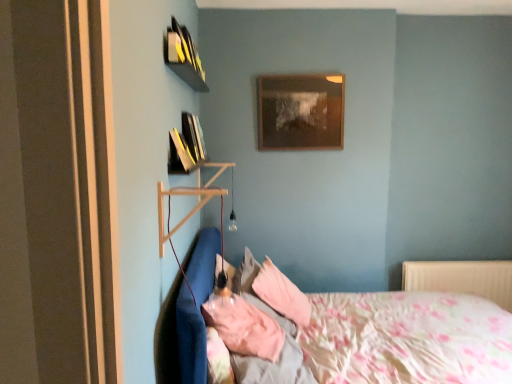
The width and height of the screenshot is (512, 384). What do you see at coordinates (186, 146) in the screenshot?
I see `hardcover books at upper left, which ranks as the 2th book in top-to-bottom order` at bounding box center [186, 146].

The width and height of the screenshot is (512, 384). Describe the element at coordinates (407, 338) in the screenshot. I see `fluffy cotton bed at lower left` at that location.

Measure the distance between yellow matte book at upper left, the second book from the bottom, and camera.

A distance of 6.39 feet exists between yellow matte book at upper left, the second book from the bottom, and camera.

The width and height of the screenshot is (512, 384). I want to click on white plastic radiator at lower right, so click(x=462, y=278).

From their relative heights in the image, would you say pink fabric pillow at center, positioned as the first pillow in front-to-back order, is taller or shorter than wooden picture frame at upper center?

In the image, pink fabric pillow at center, positioned as the first pillow in front-to-back order, appears to be shorter than wooden picture frame at upper center.

From the image's perspective, is pink fabric pillow at center, positioned as the first pillow in front-to-back order, above wooden picture frame at upper center?

No, from the image's perspective, pink fabric pillow at center, positioned as the first pillow in front-to-back order, is not above wooden picture frame at upper center.

Locate an element on the screen. The image size is (512, 384). picture frame located above the pink fabric pillow at center, positioned as the first pillow in front-to-back order (from a real-world perspective) is located at coordinates (301, 112).

Considering the positions of objects pink fabric pillow at center, positioned as the first pillow in front-to-back order, and wooden picture frame at upper center in the image provided, who is in front, pink fabric pillow at center, positioned as the first pillow in front-to-back order, or wooden picture frame at upper center?

pink fabric pillow at center, positioned as the first pillow in front-to-back order, is in front.

Consider the image. From a real-world perspective, is hardcover books at upper left, which ranks as the 1th book in bottom-to-top order, positioned over yellow matte book at upper left, the second book from the bottom, based on gravity?

Actually, hardcover books at upper left, which ranks as the 1th book in bottom-to-top order, is physically below yellow matte book at upper left, the second book from the bottom, in the real world.

Where is `book above the hardcover books at upper left, which ranks as the 1th book in bottom-to-top order (from the image's perspective)`? The width and height of the screenshot is (512, 384). book above the hardcover books at upper left, which ranks as the 1th book in bottom-to-top order (from the image's perspective) is located at coordinates [184, 56].

How distant is hardcover books at upper left, which ranks as the 1th book in bottom-to-top order, from yellow matte book at upper left, the second book from the bottom?

The distance of hardcover books at upper left, which ranks as the 1th book in bottom-to-top order, from yellow matte book at upper left, the second book from the bottom, is 13.65 inches.

Can you confirm if hardcover books at upper left, which ranks as the 2th book in top-to-bottom order, is shorter than yellow matte book at upper left, the second book from the bottom?

No, hardcover books at upper left, which ranks as the 2th book in top-to-bottom order, is not shorter than yellow matte book at upper left, the second book from the bottom.

From a real-world perspective, is white plastic radiator at lower right over fluffy cotton bed at lower left?

Incorrect, from a real-world perspective, white plastic radiator at lower right is lower than fluffy cotton bed at lower left.

Looking at this image, which object is further away from the camera, white plastic radiator at lower right or fluffy cotton bed at lower left?

Positioned behind is white plastic radiator at lower right.

Which is behind, point (473, 272) or point (210, 262)?

The point (473, 272) is farther.

Can you tell me how much white plastic radiator at lower right and fluffy cotton bed at lower left differ in facing direction?

The angle between the facing direction of white plastic radiator at lower right and the facing direction of fluffy cotton bed at lower left is 90.2 degrees.

Who is more distant, wooden picture frame at upper center or pink fabric pillow at center, the 2th pillow viewed from the back?

wooden picture frame at upper center is more distant.

Is wooden picture frame at upper center oriented away from pink fabric pillow at center, positioned as the first pillow in front-to-back order?

No, wooden picture frame at upper center is not facing away from pink fabric pillow at center, positioned as the first pillow in front-to-back order.

From the picture: How much distance is there between wooden picture frame at upper center and pink fabric pillow at center, the 2th pillow viewed from the back?

A distance of 4.89 feet exists between wooden picture frame at upper center and pink fabric pillow at center, the 2th pillow viewed from the back.

Is wooden picture frame at upper center smaller than pink fabric pillow at center, positioned as the first pillow in front-to-back order?

Yes, wooden picture frame at upper center is smaller than pink fabric pillow at center, positioned as the first pillow in front-to-back order.

From a real-world perspective, does wooden picture frame at upper center stand above hardcover books at upper left, which ranks as the 2th book in top-to-bottom order?

Correct, in the physical world, wooden picture frame at upper center is higher than hardcover books at upper left, which ranks as the 2th book in top-to-bottom order.

Is wooden picture frame at upper center far from hardcover books at upper left, which ranks as the 2th book in top-to-bottom order?

No.

Which of these two, wooden picture frame at upper center or hardcover books at upper left, which ranks as the 1th book in bottom-to-top order, stands taller?

Standing taller between the two is wooden picture frame at upper center.

Identify the location of the 2nd book above the white plastic radiator at lower right (from the image's perspective). The image size is (512, 384). (184, 56).

Which is more to the right, yellow matte book at upper left, which appears as the 1th book when viewed from the top, or white plastic radiator at lower right?

white plastic radiator at lower right is more to the right.

From a real-world perspective, is yellow matte book at upper left, which appears as the 1th book when viewed from the top, above or below white plastic radiator at lower right?

In terms of real-world spatial position, yellow matte book at upper left, which appears as the 1th book when viewed from the top, is above white plastic radiator at lower right.

Looking at this image, could you tell me if yellow matte book at upper left, the second book from the bottom, is facing white plastic radiator at lower right?

No.

Can you tell me how much pink fabric pillow at center, which is the 2th pillow from front to back, and pink fabric pillow at center, positioned as the first pillow in front-to-back order, differ in facing direction?

The angular difference between pink fabric pillow at center, which is the 2th pillow from front to back, and pink fabric pillow at center, positioned as the first pillow in front-to-back order, is 9.86 degrees.

Is pink fabric pillow at center, which is the 2th pillow from front to back, bigger than pink fabric pillow at center, positioned as the first pillow in front-to-back order?

Correct, pink fabric pillow at center, which is the 2th pillow from front to back, is larger in size than pink fabric pillow at center, positioned as the first pillow in front-to-back order.

This screenshot has width=512, height=384. What are the coordinates of `pillow below the pink fabric pillow at center, positioned as the first pillow in front-to-back order (from a real-world perspective)` in the screenshot? It's located at (281, 293).

Is pink fabric pillow at center, which is the 2th pillow from front to back, at the right side of pink fabric pillow at center, positioned as the first pillow in front-to-back order?

Yes, pink fabric pillow at center, which is the 2th pillow from front to back, is to the right of pink fabric pillow at center, positioned as the first pillow in front-to-back order.

Starting from the wooden picture frame at upper center, which pillow is the 2nd one in front? Please provide its 2D coordinates.

[(244, 327)]

You are a GUI agent. You are given a task and a screenshot of the screen. Output one action in this format:
    pyautogui.click(x=<x>, y=<y>)
    Task: Click on the book above the hardcover books at upper left, which ranks as the 2th book in top-to-bottom order (from a real-world perspective)
    This screenshot has height=384, width=512.
    Given the screenshot: What is the action you would take?
    pyautogui.click(x=184, y=56)

Which object lies nearer to the anchor point yellow matte book at upper left, which appears as the 1th book when viewed from the top, hardcover books at upper left, which ranks as the 1th book in bottom-to-top order, or pink fabric pillow at center, the 2th pillow viewed from the back?

Based on the image, hardcover books at upper left, which ranks as the 1th book in bottom-to-top order, appears to be nearer to yellow matte book at upper left, which appears as the 1th book when viewed from the top.

From the image, which object appears to be nearer to fluffy cotton bed at lower left, yellow matte book at upper left, the second book from the bottom, or hardcover books at upper left, which ranks as the 1th book in bottom-to-top order?

Among the two, hardcover books at upper left, which ranks as the 1th book in bottom-to-top order, is located nearer to fluffy cotton bed at lower left.

Which object lies further to the anchor point wooden picture frame at upper center, pink fabric pillow at center, arranged as the first pillow when viewed from the back, or yellow matte book at upper left, the second book from the bottom?

Among the two, pink fabric pillow at center, arranged as the first pillow when viewed from the back, is located further to wooden picture frame at upper center.

From the picture: Which object lies further to the anchor point wooden picture frame at upper center, pink fabric pillow at center, positioned as the first pillow in front-to-back order, or hardcover books at upper left, which ranks as the 1th book in bottom-to-top order?

Based on the image, pink fabric pillow at center, positioned as the first pillow in front-to-back order, appears to be further to wooden picture frame at upper center.

Estimate the real-world distances between objects in this image. Which object is closer to pink fabric pillow at center, which is the 2th pillow from front to back, hardcover books at upper left, which ranks as the 1th book in bottom-to-top order, or wooden picture frame at upper center?

hardcover books at upper left, which ranks as the 1th book in bottom-to-top order.

From the picture: Estimate the real-world distances between objects in this image. Which object is further from fluffy cotton bed at lower left, wooden picture frame at upper center or white plastic radiator at lower right?

wooden picture frame at upper center is further to fluffy cotton bed at lower left.

Based on their spatial positions, is hardcover books at upper left, which ranks as the 2th book in top-to-bottom order, or yellow matte book at upper left, which appears as the 1th book when viewed from the top, closer to fluffy cotton bed at lower left?

hardcover books at upper left, which ranks as the 2th book in top-to-bottom order, lies closer to fluffy cotton bed at lower left than the other object.

When comparing their distances from fluffy cotton bed at lower left, does pink fabric pillow at center, which is the 2th pillow from front to back, or yellow matte book at upper left, the second book from the bottom, seem closer?

pink fabric pillow at center, which is the 2th pillow from front to back, is positioned closer to the anchor fluffy cotton bed at lower left.

I want to click on pillow between hardcover books at upper left, which ranks as the 2th book in top-to-bottom order, and pink fabric pillow at center, positioned as the first pillow in front-to-back order, from top to bottom, so click(x=281, y=293).

Locate an element on the screen. The image size is (512, 384). book that lies between wooden picture frame at upper center and fluffy cotton bed at lower left from top to bottom is located at coordinates (186, 146).

Find the location of a particular element. The height and width of the screenshot is (384, 512). picture frame between yellow matte book at upper left, which appears as the 1th book when viewed from the top, and fluffy cotton bed at lower left vertically is located at coordinates (301, 112).

Identify the location of picture frame between yellow matte book at upper left, which appears as the 1th book when viewed from the top, and pink fabric pillow at center, which is the 2th pillow from front to back, in the vertical direction. Image resolution: width=512 pixels, height=384 pixels. (301, 112).